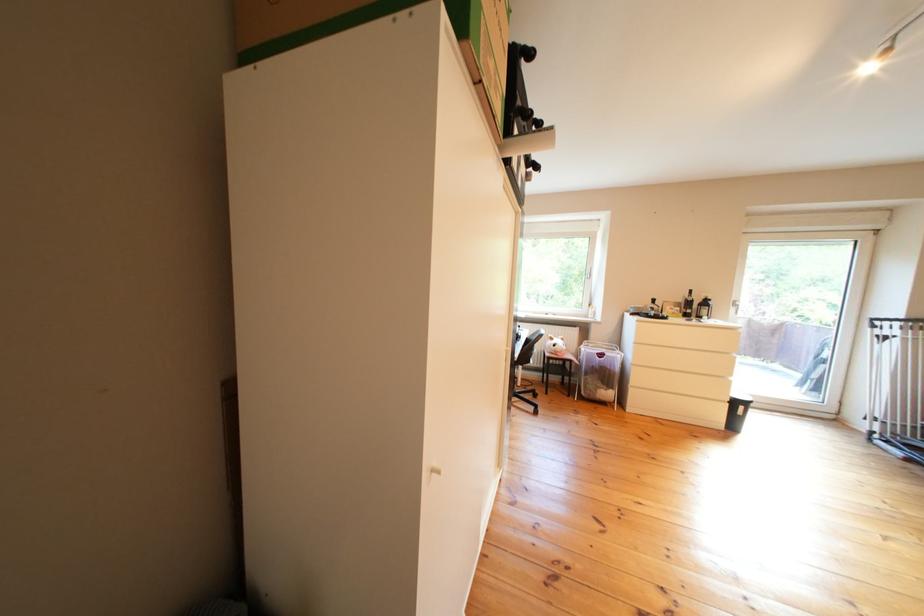
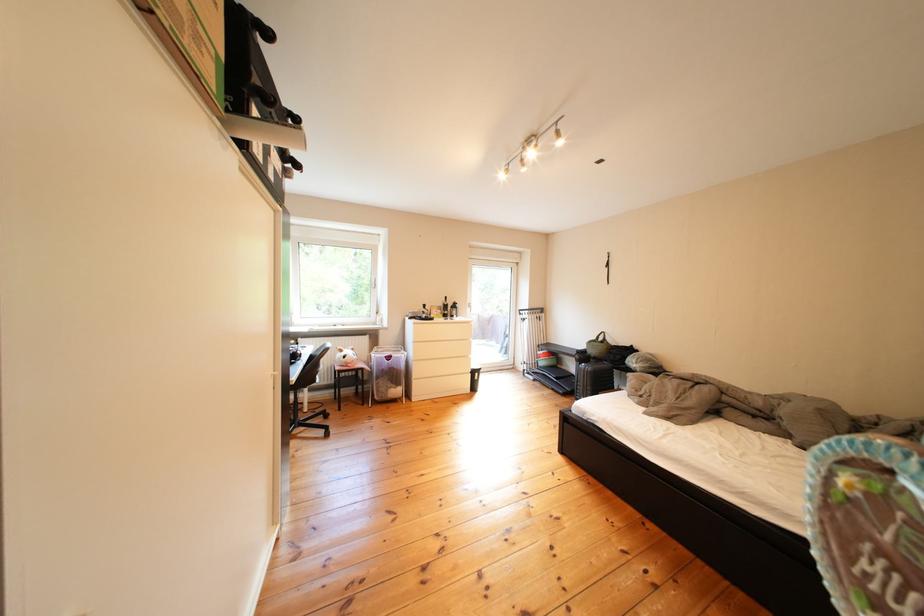
The point at (x=568, y=350) is marked in the first image. Where is the corresponding point in the second image?

(359, 361)